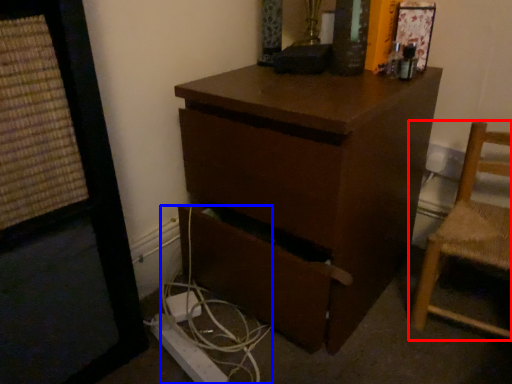
Question: Among these objects, which one is nearest to the camera, chair (highlighted by a red box) or cable (highlighted by a blue box)?

Choices:
 (A) chair
 (B) cable

Answer: (A)